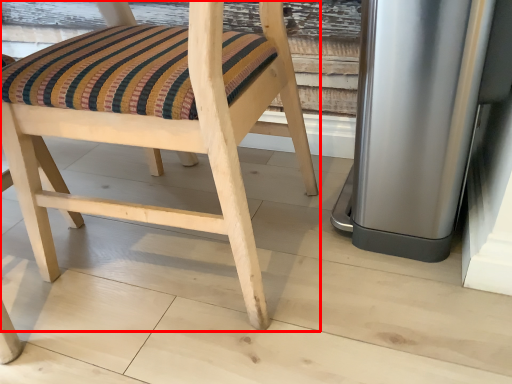
Question: Where is chair (annotated by the red box) located in relation to appliance in the image?

Choices:
 (A) left
 (B) right

Answer: (A)